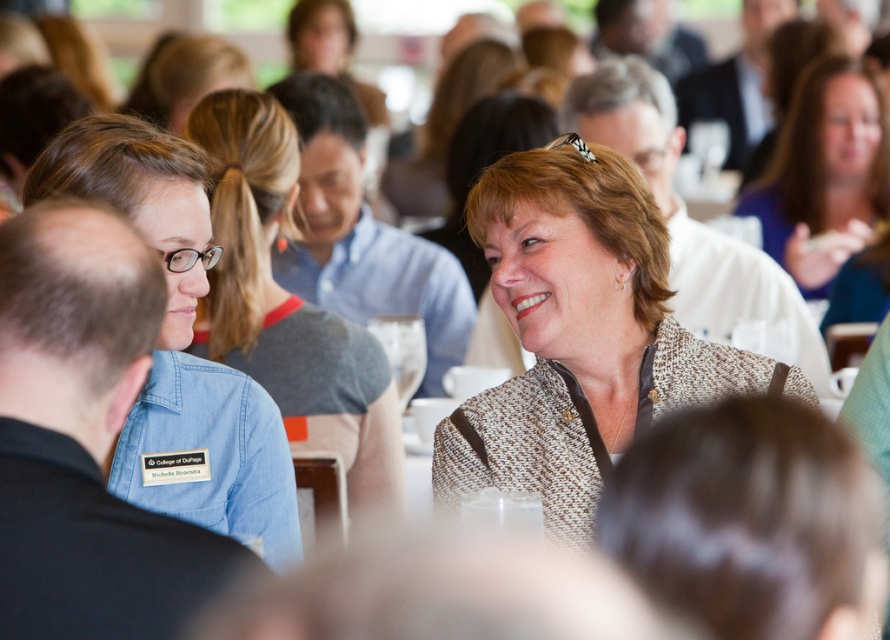
Who is lower down, blue denim shirt at center or matte brown blazer at center?

blue denim shirt at center is below.

Between blue denim shirt at center and matte brown blazer at center, which one has less height?

Standing shorter between the two is matte brown blazer at center.

Identify the location of blue denim shirt at center. (288, 305).

Between point (520, 412) and point (797, 138), which one is positioned in front?

Point (520, 412) is more forward.

Can you confirm if brown textured blazer at center is shorter than matte brown blazer at center?

Indeed, brown textured blazer at center has a lesser height compared to matte brown blazer at center.

Image resolution: width=890 pixels, height=640 pixels. What do you see at coordinates (580, 333) in the screenshot? I see `brown textured blazer at center` at bounding box center [580, 333].

Where is `brown textured blazer at center`? Image resolution: width=890 pixels, height=640 pixels. brown textured blazer at center is located at coordinates (580, 333).

Which is below, brown textured blazer at center or blue denim shirt at center?

brown textured blazer at center is below.

Which is above, brown textured blazer at center or blue denim shirt at center?

Result: blue denim shirt at center is higher up.

Is point (656, 305) farther from viewer compared to point (297, 376)?

No, (656, 305) is closer to viewer.

The height and width of the screenshot is (640, 890). I want to click on brown textured blazer at center, so click(580, 333).